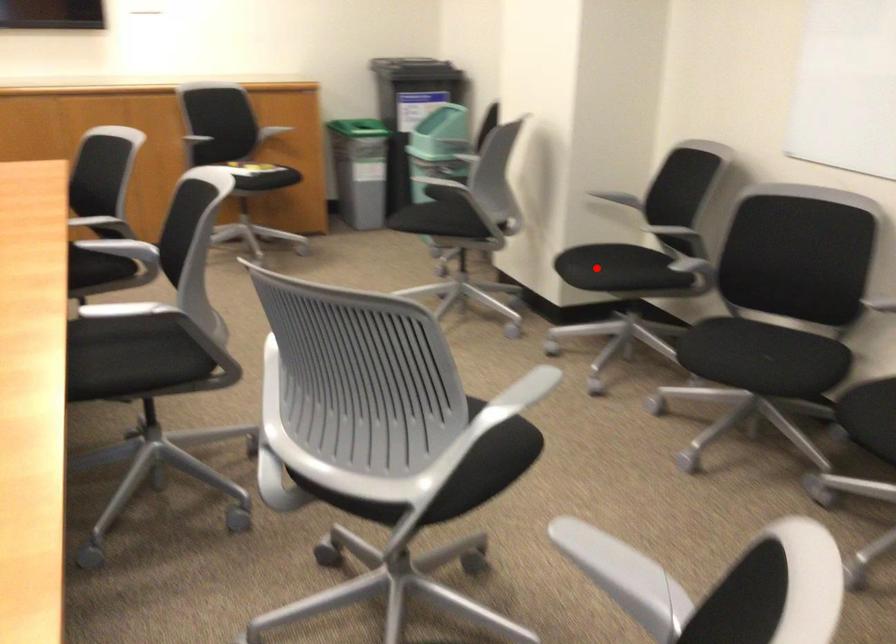
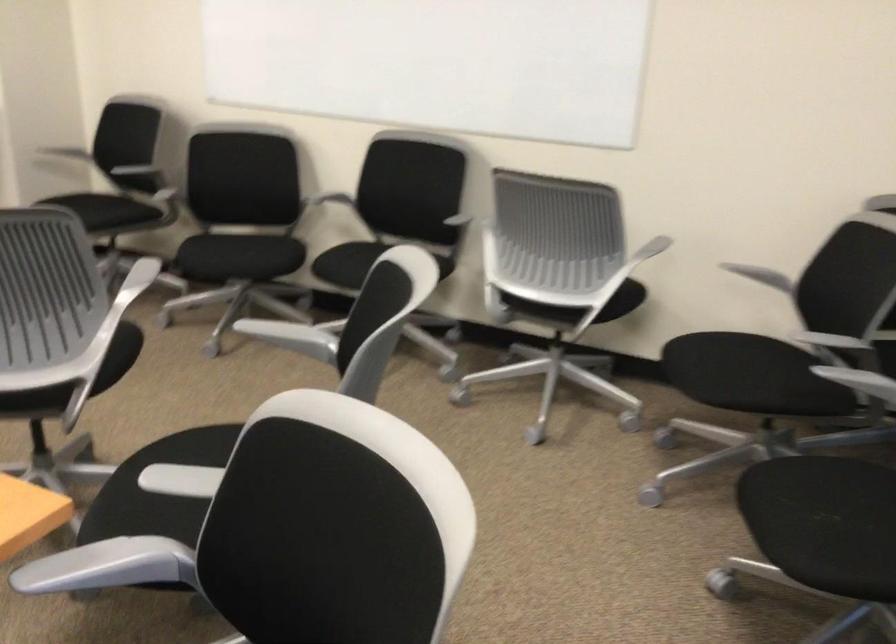
Locate, in the second image, the point that corresponds to the highlighted location in the first image.

(97, 213)